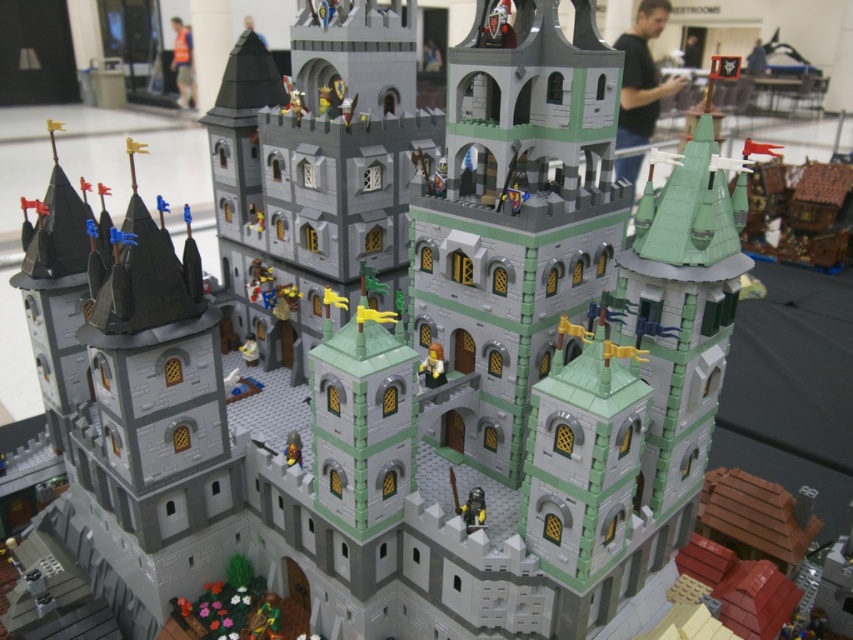
Question: Which of the following is the closest to the observer?

Choices:
 (A) (483, 490)
 (B) (421, 371)
 (C) (256, 349)

Answer: (A)

Question: Does shiny metallic knight at lower center appear on the left side of light blue plastic minifigure at center?

Choices:
 (A) yes
 (B) no

Answer: (B)

Question: Which object appears farthest from the camera in this image?

Choices:
 (A) light brown plastic minifigure at center
 (B) shiny metallic knight at lower center

Answer: (A)

Question: Observing the image, what is the correct spatial positioning of light brown plastic minifigure at center in reference to light blue plastic minifigure at center?

Choices:
 (A) above
 (B) below

Answer: (B)

Question: Can you confirm if light brown plastic minifigure at center is thinner than light blue plastic minifigure at center?

Choices:
 (A) yes
 (B) no

Answer: (B)

Question: Among these points, which one is nearest to the camera?

Choices:
 (A) (253, 348)
 (B) (428, 348)

Answer: (B)